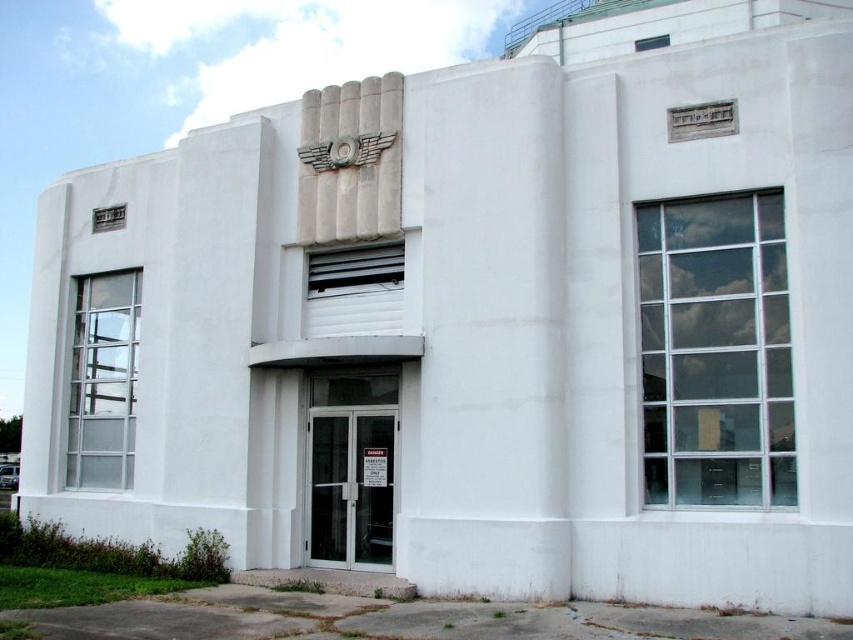
Question: Which object is closer to the camera taking this photo?

Choices:
 (A) metallic silver clock at center
 (B) white smooth concrete pillar at center

Answer: (B)

Question: Which point is farther from the camera taking this photo?

Choices:
 (A) (335, 160)
 (B) (515, 237)

Answer: (A)

Question: Is white smooth concrete pillar at center positioned behind metallic silver clock at center?

Choices:
 (A) yes
 (B) no

Answer: (B)

Question: Does white smooth concrete pillar at center appear under metallic silver clock at center?

Choices:
 (A) no
 (B) yes

Answer: (B)

Question: Is white smooth concrete pillar at center to the left of metallic silver clock at center from the viewer's perspective?

Choices:
 (A) no
 (B) yes

Answer: (A)